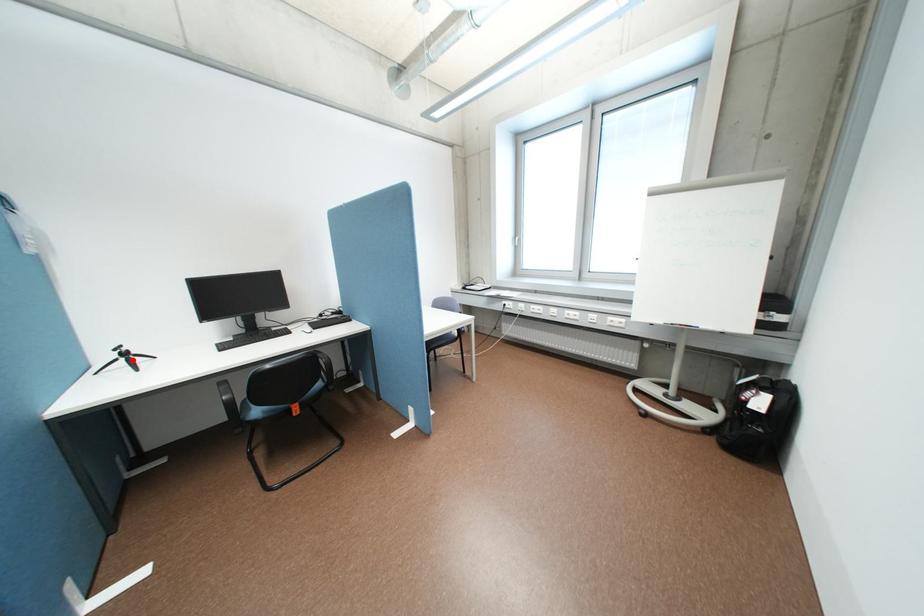
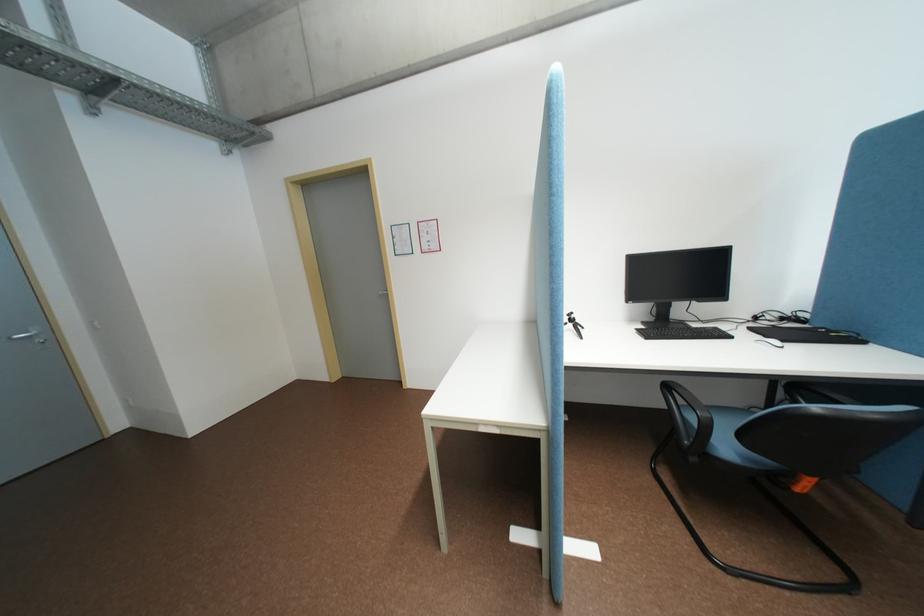
Find the pixel in the second image that matches the highlighted location in the first image.

(581, 325)